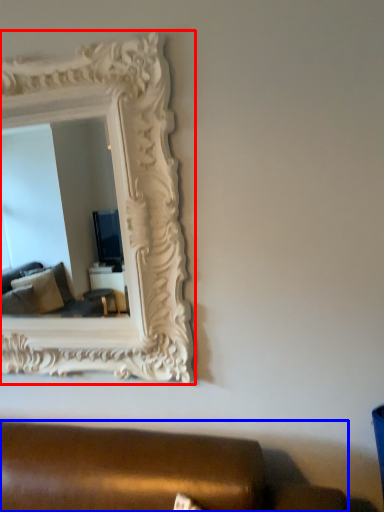
Question: Which point is closer to the camera, picture frame (highlighted by a red box) or studio couch (highlighted by a blue box)?

Choices:
 (A) picture frame
 (B) studio couch

Answer: (B)